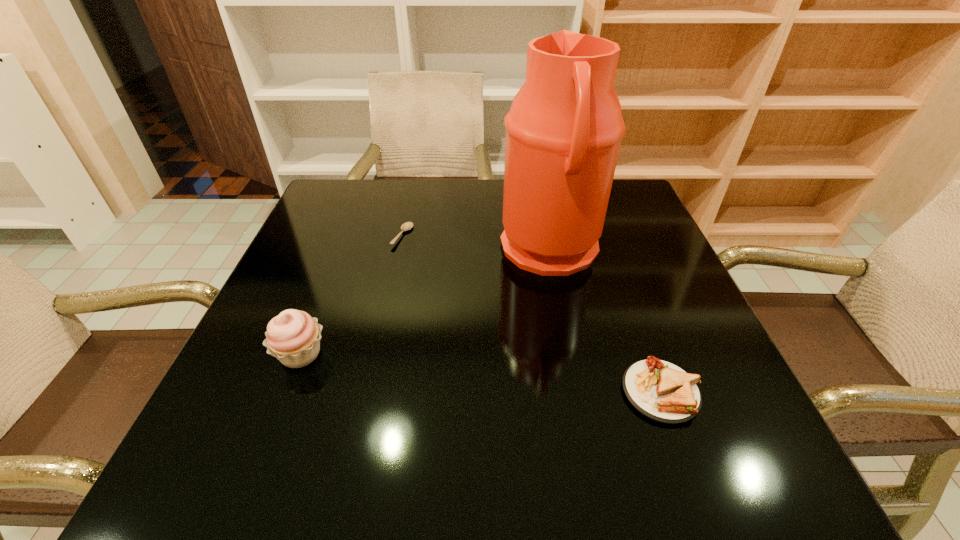
Locate an element on the screen. This screenshot has width=960, height=540. free space located on the left of the sandwich is located at coordinates (468, 392).

At what (x,y) coordinates should I click in order to perform the action: click on free point located 0.210m on the back of the shortest object. Please return your answer as a coordinate pair (x, y). Looking at the image, I should click on (415, 183).

You are a GUI agent. You are given a task and a screenshot of the screen. Output one action in this format:
    pyautogui.click(x=<x>, y=<y>)
    Task: Click on the water jug at the far edge
    
    Given the screenshot: What is the action you would take?
    pyautogui.click(x=563, y=132)

Where is `soupspoon that is at the far edge`? soupspoon that is at the far edge is located at coordinates (x=406, y=226).

Where is `object situated at the left edge`? The width and height of the screenshot is (960, 540). object situated at the left edge is located at coordinates (293, 337).

Locate an element on the screen. This screenshot has height=540, width=960. water jug positioned at the right edge is located at coordinates (563, 132).

Locate an element on the screen. sandwich present at the right edge is located at coordinates (660, 390).

I want to click on object present at the far right corner, so click(563, 132).

In the image, there is a desktop. In order to click on vacant space at the far edge in this screenshot , I will do `click(379, 220)`.

This screenshot has width=960, height=540. What are the coordinates of `vacant space at the near edge of the desktop` in the screenshot? It's located at (556, 456).